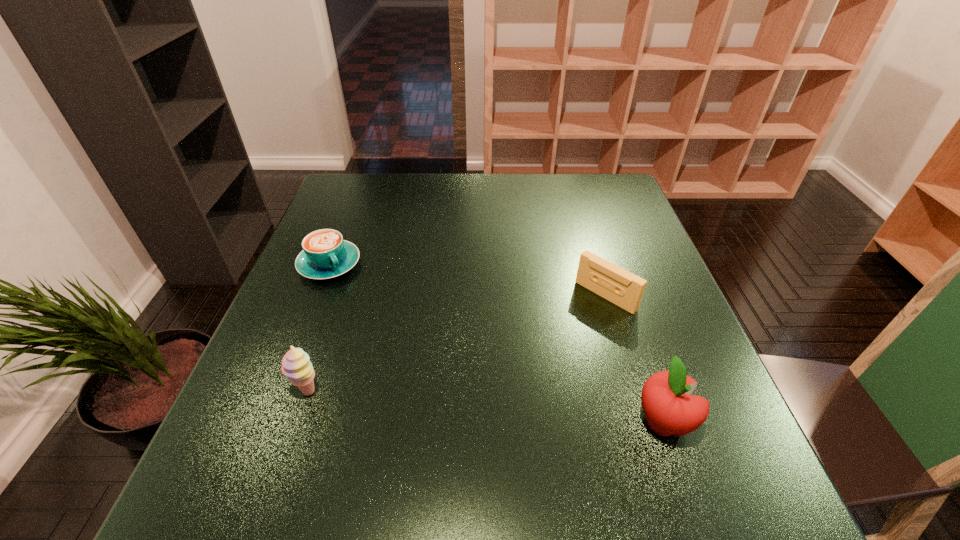
Identify the location of sherbert. (296, 365).

The height and width of the screenshot is (540, 960). Identify the location of apple. (670, 409).

Where is `cappuccino`? cappuccino is located at coordinates (325, 255).

This screenshot has height=540, width=960. Find the location of `the second shortest object`. the second shortest object is located at coordinates pyautogui.click(x=619, y=286).

This screenshot has height=540, width=960. What are the coordinates of `free region located on the right of the sherbert` in the screenshot? It's located at [x=363, y=392].

Locate an element on the screen. Image resolution: width=960 pixels, height=540 pixels. free spot located 0.060m on the side where a bite is taken out of the apple is located at coordinates (726, 422).

I want to click on vacant space located 0.320m with the handle on the right side of the shortest object, so click(x=404, y=368).

Identify the location of vacant point located with the handle on the right side of the shortest object. (412, 379).

Locate an element on the screen. vacant space situated 0.220m with the handle on the right side of the shortest object is located at coordinates (382, 338).

Find the location of `free space located at the front of the videotape with spools`. free space located at the front of the videotape with spools is located at coordinates (490, 404).